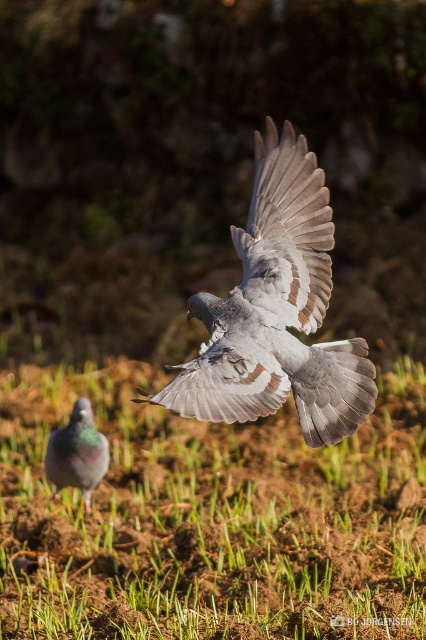
Question: From the image, what is the correct spatial relationship of gray feathered bird at center in relation to white feathered wing at center?

Choices:
 (A) above
 (B) below

Answer: (B)

Question: Is gray feathered bird at center bigger than white feathered wing at center?

Choices:
 (A) no
 (B) yes

Answer: (B)

Question: Which point is closer to the camera?

Choices:
 (A) gray feathered bird at center
 (B) green grass at lower center
 (C) white feathered wing at center
 (D) gray matte pigeon at lower left

Answer: (A)

Question: Does green grass at lower center have a larger size compared to gray feathered bird at center?

Choices:
 (A) yes
 (B) no

Answer: (A)

Question: Among these objects, which one is farthest from the camera?

Choices:
 (A) gray matte pigeon at lower left
 (B) gray feathered bird at center
 (C) green grass at lower center

Answer: (A)

Question: Estimate the real-world distances between objects in this image. Which object is closer to the white feathered wing at center?

Choices:
 (A) gray feathered bird at center
 (B) green grass at lower center

Answer: (A)